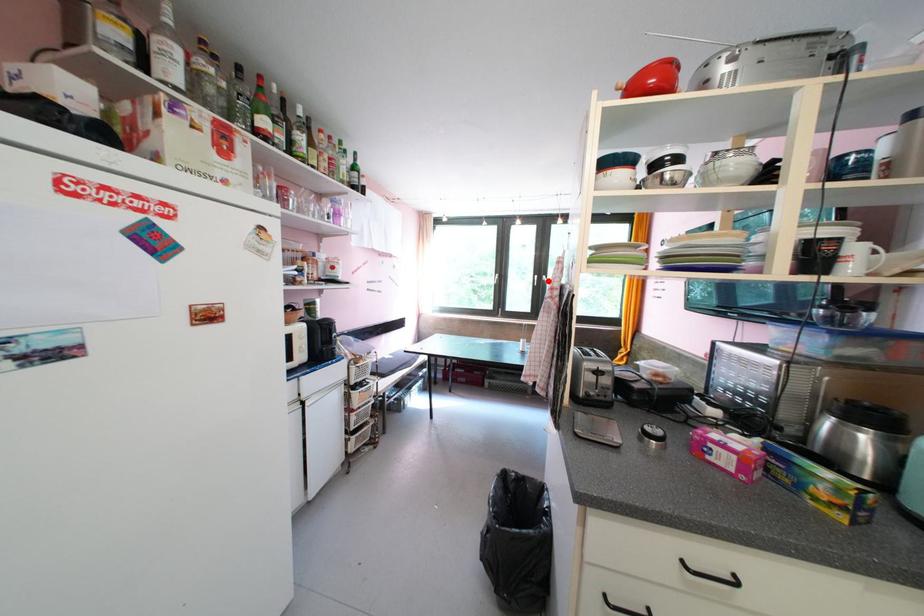
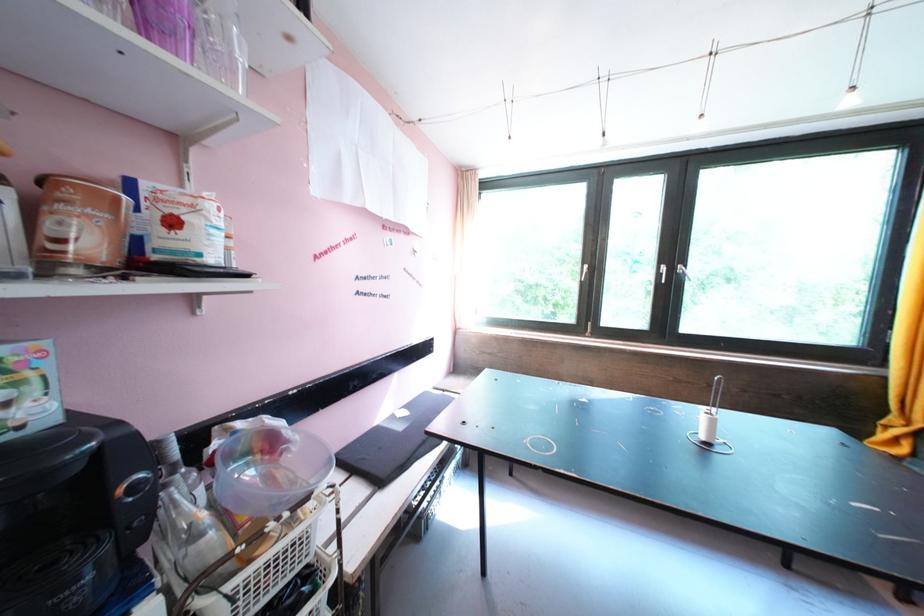
Where in the second image is the point corresponding to the highlighted location from the first image?

(679, 273)